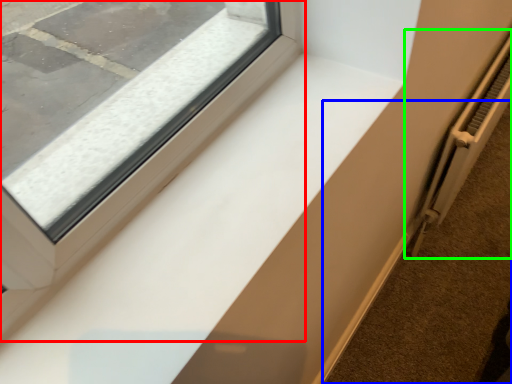
Question: Considering the real-world distances, which object is farthest from window (highlighted by a red box)? pavement (highlighted by a blue box) or radiator (highlighted by a green box)?

Choices:
 (A) pavement
 (B) radiator

Answer: (A)